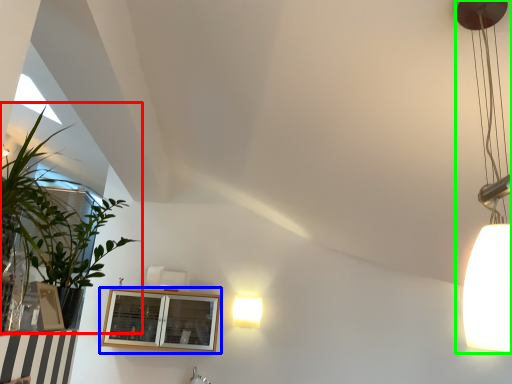
Question: Estimate the real-world distances between objects in this image. Which object is farther from houseplant (highlighted by a red box), window (highlighted by a blue box) or lamp (highlighted by a green box)?

Choices:
 (A) window
 (B) lamp

Answer: (A)